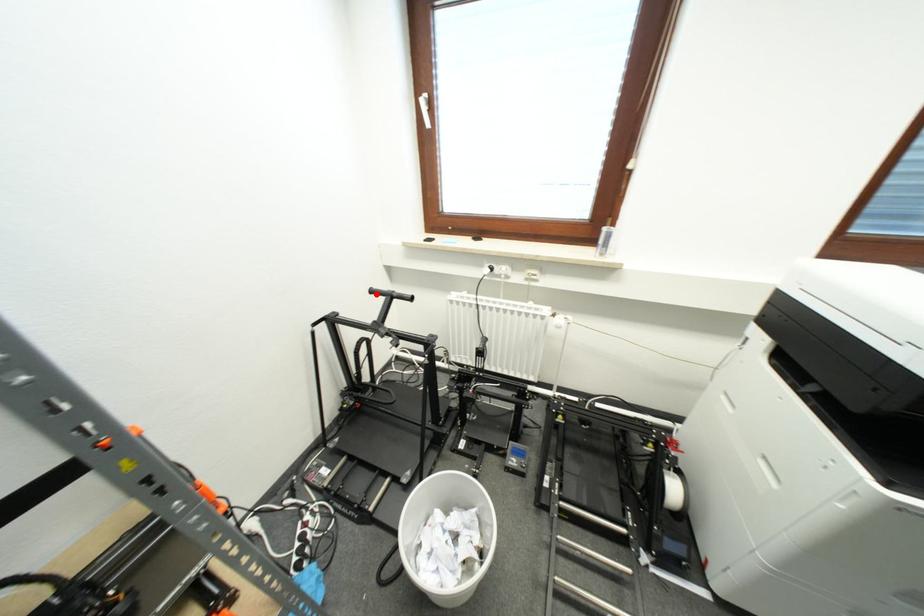
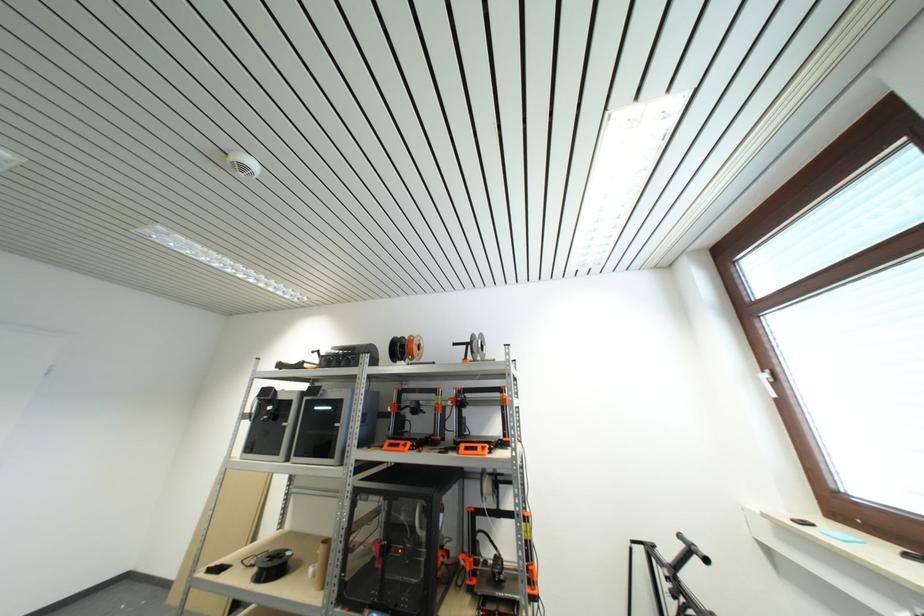
The point at the highlighted location is marked in the first image. Where is the corresponding point in the second image?

(685, 540)